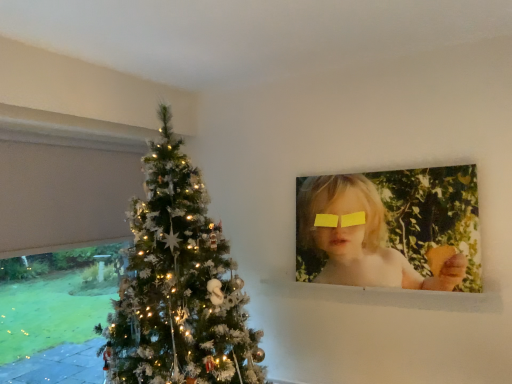
Question: Is point (449, 276) closer or farther from the camera than point (335, 221)?

Choices:
 (A) closer
 (B) farther

Answer: (A)

Question: Is matte yellow paper at upper right taller or shorter than yellow matte glasses at upper center?

Choices:
 (A) tall
 (B) short

Answer: (A)

Question: From a real-world perspective, is matte yellow paper at upper right positioned above or below yellow matte glasses at upper center?

Choices:
 (A) above
 (B) below

Answer: (B)

Question: Does point (318, 215) appear closer or farther from the camera than point (381, 228)?

Choices:
 (A) farther
 (B) closer

Answer: (A)

Question: Choose the correct answer: Is yellow matte glasses at upper center inside matte yellow paper at upper right or outside it?

Choices:
 (A) inside
 (B) outside

Answer: (A)

Question: From the image's perspective, is yellow matte glasses at upper center located above or below matte yellow paper at upper right?

Choices:
 (A) above
 (B) below

Answer: (A)

Question: Considering the relative positions of yellow matte glasses at upper center and matte yellow paper at upper right in the image provided, is yellow matte glasses at upper center to the left or to the right of matte yellow paper at upper right?

Choices:
 (A) left
 (B) right

Answer: (A)